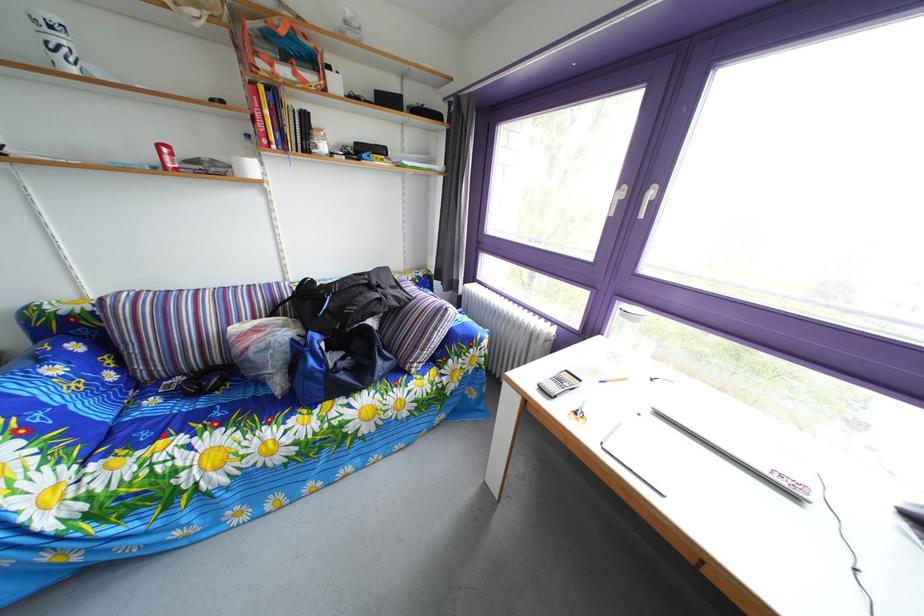
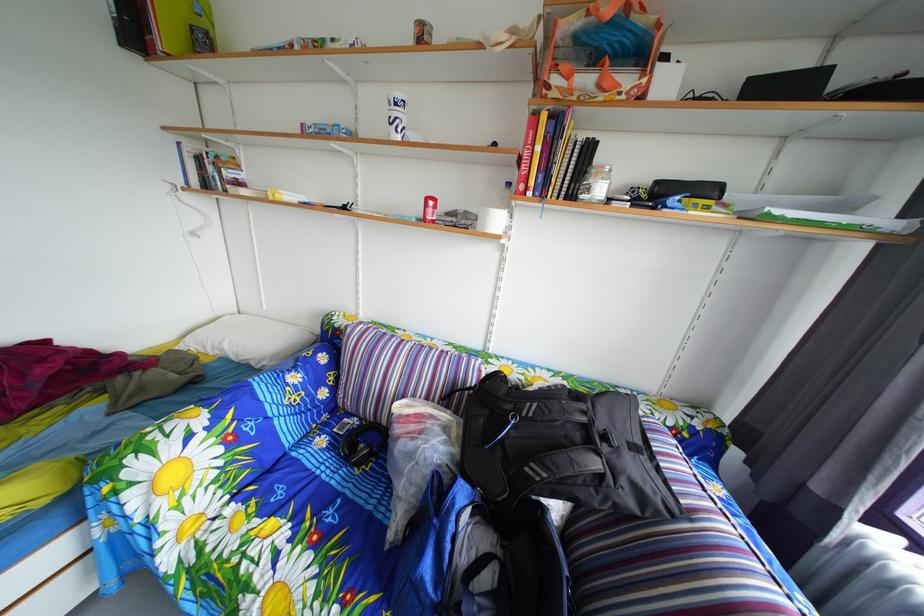
Locate, in the second image, the point that corresponds to the highlighted location in the first image.

(301, 493)